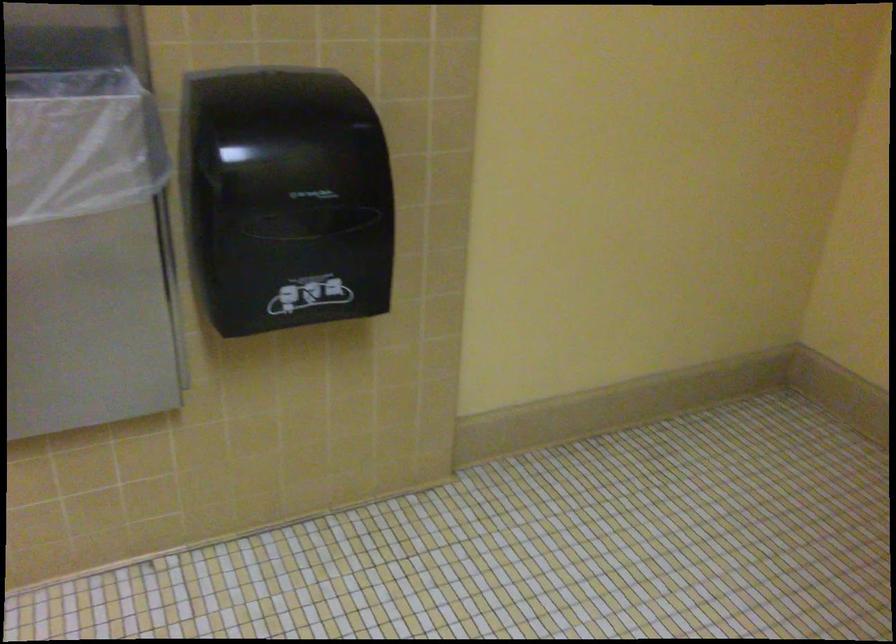
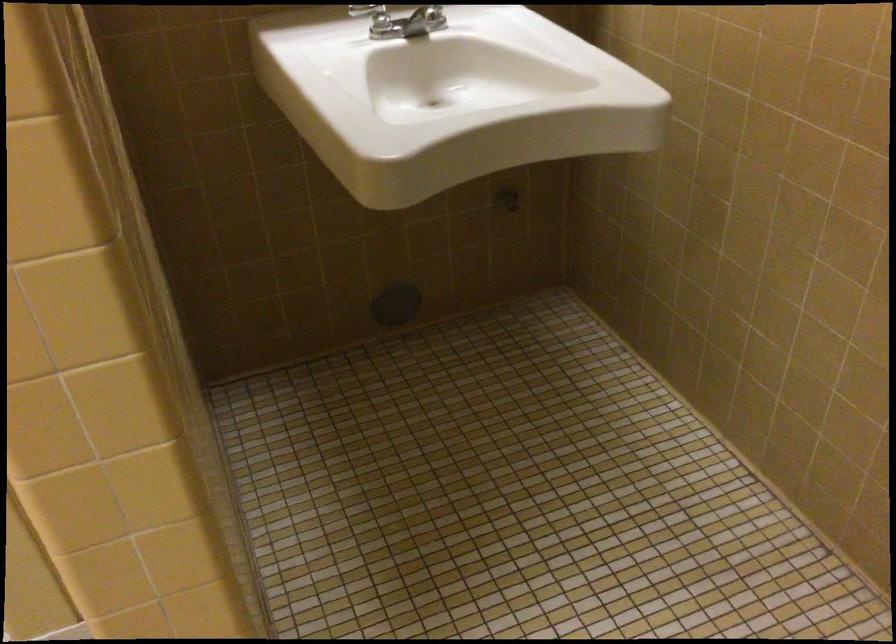
First-person continuous shooting, in which direction is the camera rotating?

The camera's rotation is toward left-down.